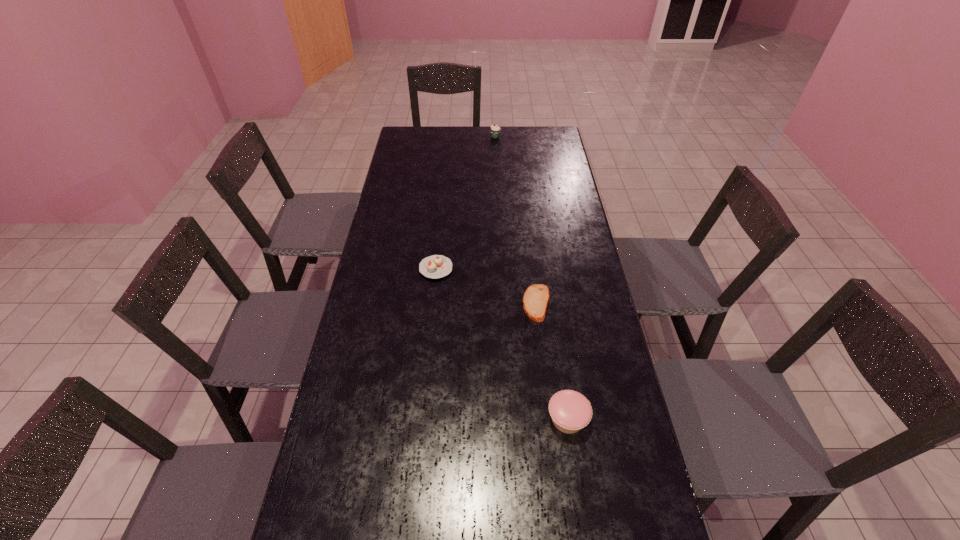
Where is `object identified as the second closest to the leftmost cupcake`? This screenshot has width=960, height=540. object identified as the second closest to the leftmost cupcake is located at coordinates click(570, 411).

Locate which object is the second closest to the leftmost cupcake. Please provide its 2D coordinates. Your answer should be formatted as a tuple, i.e. [(x, y)], where the tuple contains the x and y coordinates of a point satisfying the conditions above.

[(570, 411)]

At what (x,y) coordinates should I click in order to perform the action: click on cupcake that is the closest to the second farthest cupcake. Please return your answer as a coordinate pair (x, y). Image resolution: width=960 pixels, height=540 pixels. Looking at the image, I should click on (570, 411).

You are a GUI agent. You are given a task and a screenshot of the screen. Output one action in this format:
    pyautogui.click(x=<x>, y=<y>)
    Task: Click on the cupcake that stands as the closest to the shortest object
    The width and height of the screenshot is (960, 540).
    Given the screenshot: What is the action you would take?
    pyautogui.click(x=436, y=266)

I want to click on free point that satisfies the following two spatial constraints: 1. on the front side of the second cupcake from right to left; 2. on the right side of the second nearest object, so click(x=503, y=303).

You are a GUI agent. You are given a task and a screenshot of the screen. Output one action in this format:
    pyautogui.click(x=<x>, y=<y>)
    Task: Click on the vacant area that satisfies the following two spatial constraints: 1. on the front side of the second object from left to right; 2. on the left side of the rightmost cupcake
    Image resolution: width=960 pixels, height=540 pixels.
    Given the screenshot: What is the action you would take?
    pyautogui.click(x=509, y=419)